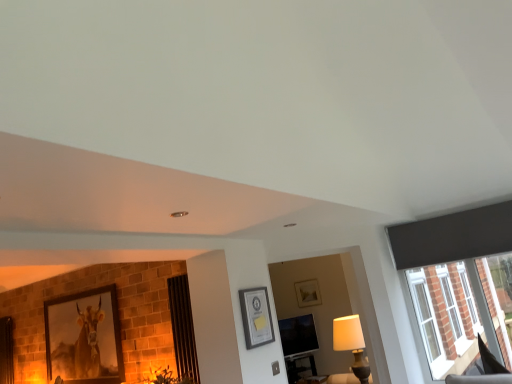
Question: Is white fabric lampshade at lower right smaller than matte wooden picture frame at left, the 2th picture frame in the front-to-back sequence?

Choices:
 (A) no
 (B) yes

Answer: (A)

Question: Does white fabric lampshade at lower right have a greater width compared to matte wooden picture frame at left, which ranks as the first picture frame in back-to-front order?

Choices:
 (A) no
 (B) yes

Answer: (A)

Question: Considering the relative sizes of white fabric lampshade at lower right and matte wooden picture frame at left, which ranks as the first picture frame in back-to-front order, in the image provided, is white fabric lampshade at lower right taller than matte wooden picture frame at left, which ranks as the first picture frame in back-to-front order,?

Choices:
 (A) yes
 (B) no

Answer: (B)

Question: From a real-world perspective, is white fabric lampshade at lower right located higher than matte wooden picture frame at left, which ranks as the first picture frame in back-to-front order?

Choices:
 (A) no
 (B) yes

Answer: (A)

Question: Can you confirm if white fabric lampshade at lower right is bigger than matte wooden picture frame at left, which is counted as the 2th picture frame, starting from the right?

Choices:
 (A) no
 (B) yes

Answer: (B)

Question: Can you confirm if white fabric lampshade at lower right is thinner than matte wooden picture frame at left, the 2th picture frame in the front-to-back sequence?

Choices:
 (A) no
 (B) yes

Answer: (B)

Question: From a real-world perspective, is matte black screen at center positioned under matte wooden picture frame at left, which ranks as the first picture frame in back-to-front order, based on gravity?

Choices:
 (A) yes
 (B) no

Answer: (A)

Question: Is matte black screen at center completely or partially outside of matte wooden picture frame at left, positioned as the first picture frame in bottom-to-top order?

Choices:
 (A) yes
 (B) no

Answer: (A)

Question: Is matte black screen at center taller than matte wooden picture frame at left, which ranks as the first picture frame in back-to-front order?

Choices:
 (A) yes
 (B) no

Answer: (B)

Question: Can you confirm if matte black screen at center is smaller than matte wooden picture frame at left, positioned as the first picture frame in bottom-to-top order?

Choices:
 (A) yes
 (B) no

Answer: (A)

Question: Considering the relative sizes of matte black screen at center and matte wooden picture frame at left, which is counted as the 2th picture frame, starting from the right, in the image provided, is matte black screen at center shorter than matte wooden picture frame at left, which is counted as the 2th picture frame, starting from the right,?

Choices:
 (A) no
 (B) yes

Answer: (B)

Question: Does matte black screen at center have a lesser width compared to matte wooden picture frame at left, the 2th picture frame in the front-to-back sequence?

Choices:
 (A) no
 (B) yes

Answer: (B)

Question: From the image's perspective, is white fabric lampshade at lower right located above matte black picture frame at center, which is the first picture frame from right to left?

Choices:
 (A) no
 (B) yes

Answer: (A)